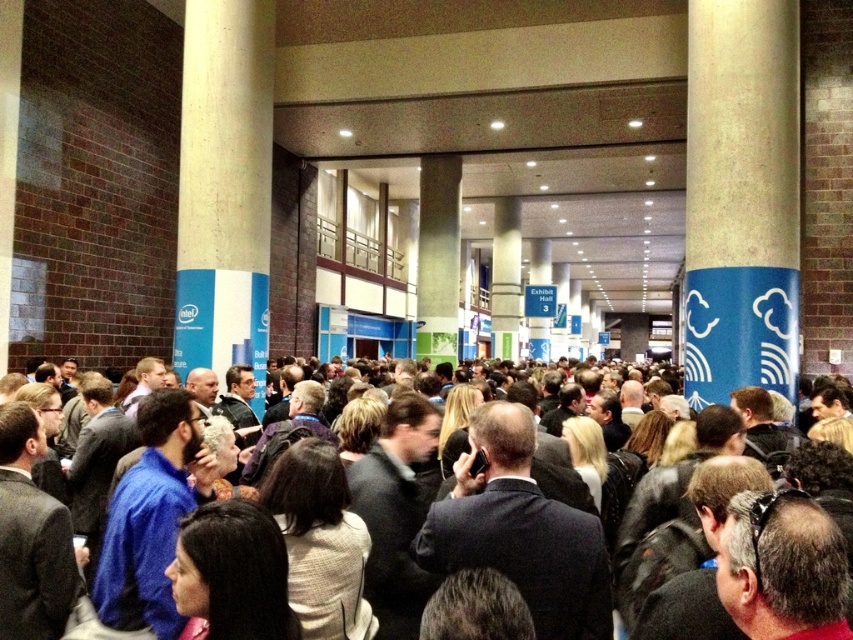
You are an attendee at the convention and want to locate the Exhibit Hall 3 sign. You notice the blue textured pillar at right and the dark suit at center. Which object is taller, and how might this help you navigate?

The blue textured pillar at right is much taller than the dark suit at center. Since the pillar is taller, it might be easier to use as a landmark to locate the overhead Exhibit Hall 3 signs, which are likely positioned higher up near the ceiling.

You are standing in the convention hall and want to reach the Intel logo on the column. The Intel logo is located at point (x=759, y=70). If you can walk 12 meters before needing to rest, will you reach the Intel logo before needing to rest?

The point (x=759, y=70) is 10.29 meters from the viewer. Since you can walk 12 meters before resting, you will reach the Intel logo before needing to rest.

You are an event planner trying to place a banner between the blue textured pillar at right and the smooth concrete pillar at left. Which pillar should the banner be placed closer to if you want it to be more noticeable to people entering the hallway?

The banner should be placed closer to the smooth concrete pillar at left because it is larger in size than the blue textured pillar at right, making it a more prominent feature for visibility.